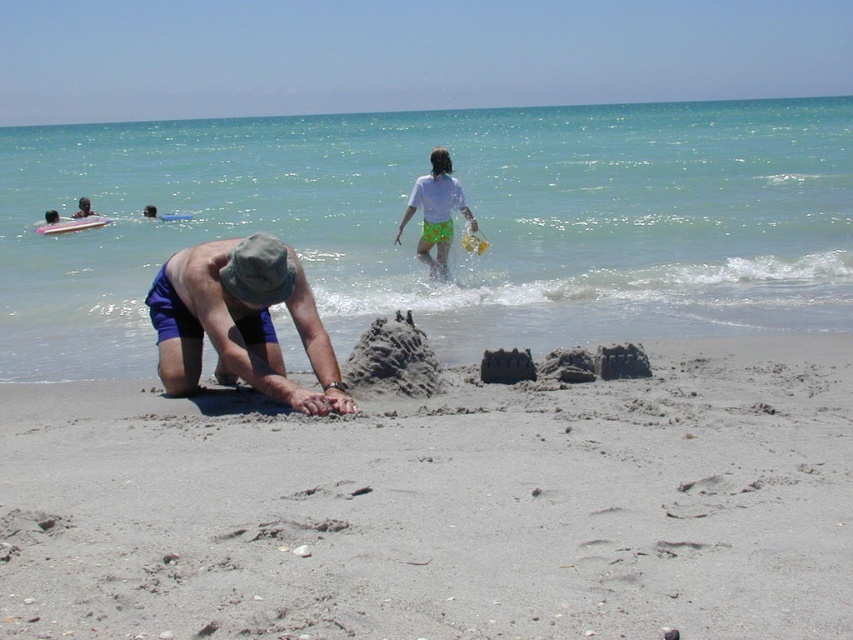
Does gray sandcastle at center have a lesser height compared to white cotton shirt at upper center?

Yes.

Which is behind, point (210, 404) or point (428, 236)?

The point (428, 236) is more distant.

Image resolution: width=853 pixels, height=640 pixels. In order to click on gray sandcastle at center in this screenshot , I will do `click(442, 508)`.

Does smooth blue shorts at lower left have a greater width compared to smooth skin person at upper left?

No.

Measure the distance between smooth blue shorts at lower left and smooth skin person at upper left.

3.30 feet

Is point (84, 204) positioned before point (154, 211)?

No, it is not.

Identify the location of smooth blue shorts at lower left. The height and width of the screenshot is (640, 853). (83, 209).

Can you confirm if gray sandcastle at center is positioned to the right of smooth blue shorts at lower left?

Indeed, gray sandcastle at center is positioned on the right side of smooth blue shorts at lower left.

Is gray sandcastle at center wider than smooth blue shorts at lower left?

Yes, gray sandcastle at center is wider than smooth blue shorts at lower left.

Where is `gray sandcastle at center`? gray sandcastle at center is located at coordinates (442, 508).